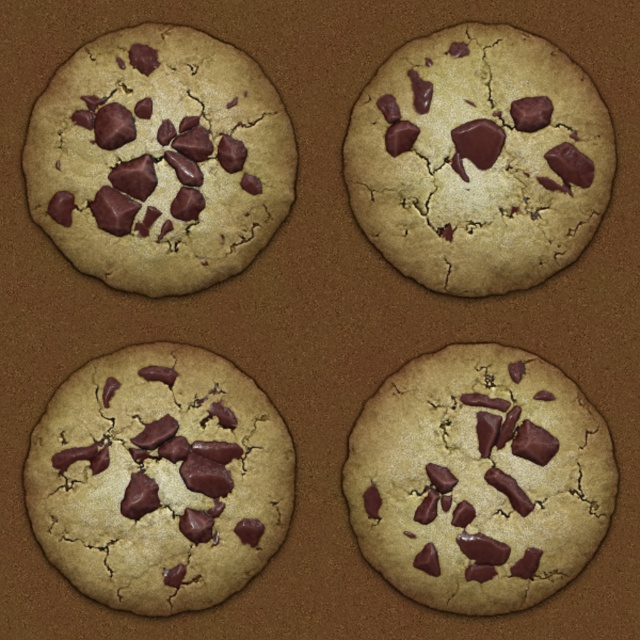
You are a photographer setting up a shot of the matte chocolate chip cookie at upper right. The camera is positioned to capture the cookie clearly. If the cookie is placed 23.38 inches from the camera, will it fill the frame adequately?

The matte chocolate chip cookie at upper right is 23.38 inches from the camera. To determine if it fills the frame, consider the camera lens focal length and sensor size. Without specific equipment details, it is impossible to confirm if the distance of 23.38 inches will result in the cookie filling the frame adequately.

You are looking at the cookies arranged in a 2x2 grid on the baking sheet. There are two points marked on the cookies at coordinates point [477,490] and point [168,483]. Which point is closer to you?

Point [168,483] is closer to you because it is less further to the camera than point [477,490].

You have two cookies in front of you, the matte chocolate chip cookie at upper right and the matte brown cookie at bottom right. You want to place both on a small plate that can only fit one cookie at a time. Which cookie should you put on the plate first to ensure it fits?

The matte brown cookie at bottom right should be placed first since it is smaller in width than the matte chocolate chip cookie at upper right, ensuring it will fit on the plate.